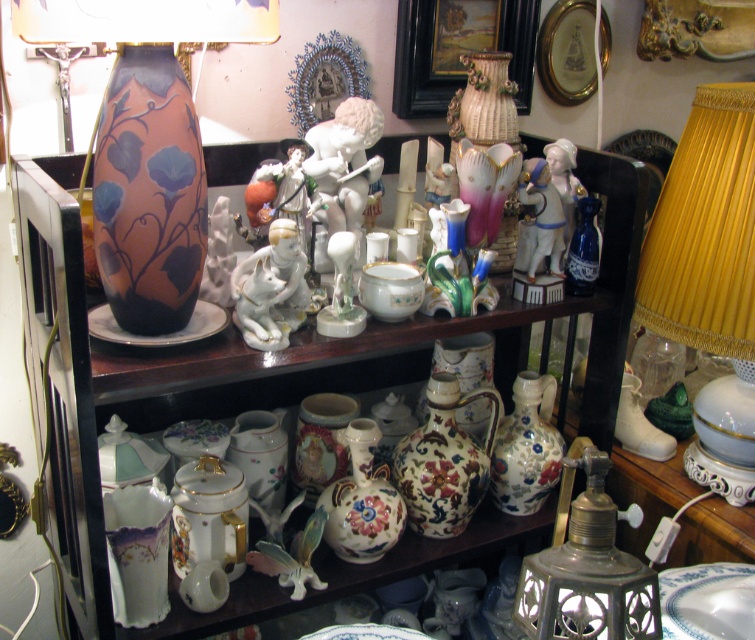
You are standing in front of a dark wooden shelf with various decorative items. You see a matte ceramic vase at upper left and a camera. How far apart are these two items?

The matte ceramic vase at upper left and camera are 31.76 inches apart from each other.

You are an interior designer arranging items on a shelf. You have the matte ceramic vase at upper left and the gold pleated lampshade at right. Which object should you place lower to ensure stability?

The gold pleated lampshade at right should be placed lower because it is shorter than the matte ceramic vase at upper left, allowing the taller vase to anchor the arrangement.

What is located at the coordinates point (284, 355)?

The matte ceramic vase at upper left is located at point (284, 355).